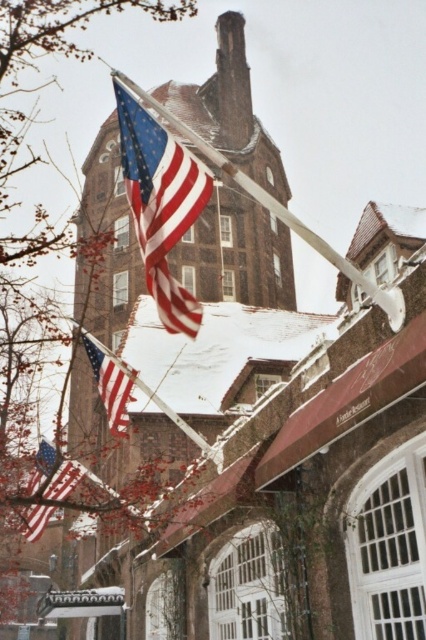
You are standing in front of the historic building and want to walk from the point marked as point (120, 112) to the point marked as point (68, 461). Based on their positions, which direction should you move relative to your current position?

Since point (120, 112) is in front of point (68, 461), you should move backward to reach point (68, 461) from your current position.

You are a photographer planning to capture the historic building with both the matte red flag at upper center and the matte red flag at lower left in the frame. Which flag will appear larger in your photo due to its height?

The matte red flag at upper center will appear larger in the photo because it is much taller than the matte red flag at lower left.